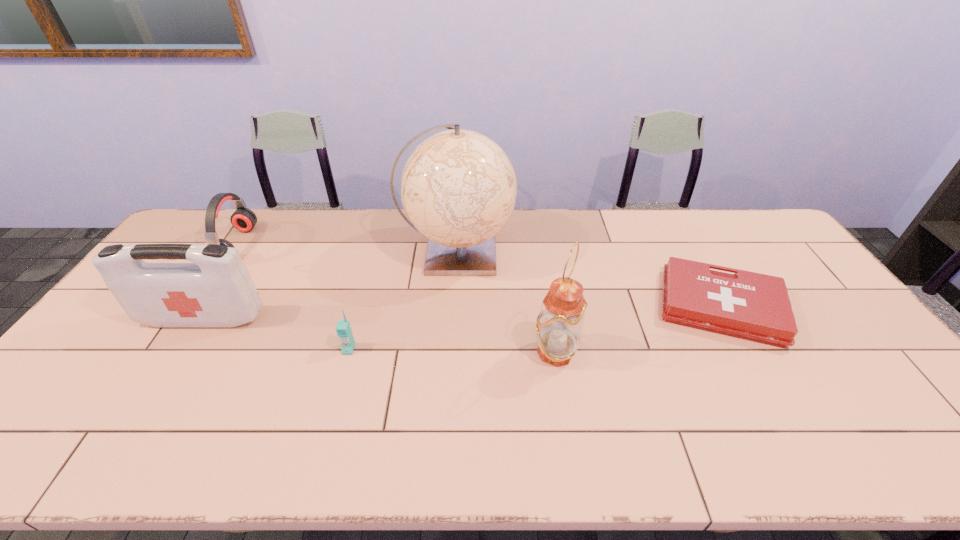
I want to click on the tallest object, so click(x=458, y=187).

Identify the location of the third object from right to left. The image size is (960, 540). (458, 187).

You are a GUI agent. You are given a task and a screenshot of the screen. Output one action in this format:
    pyautogui.click(x=<x>, y=<y>)
    Task: Click on the oil lamp
    
    Given the screenshot: What is the action you would take?
    pyautogui.click(x=559, y=325)

You are a GUI agent. You are given a task and a screenshot of the screen. Output one action in this format:
    pyautogui.click(x=<x>, y=<y>)
    Task: Click on the fifth object from left to right
    The image size is (960, 540).
    Given the screenshot: What is the action you would take?
    pyautogui.click(x=559, y=325)

Find the location of `the taller first-aid kit`. the taller first-aid kit is located at coordinates (217, 290).

Image resolution: width=960 pixels, height=540 pixels. Identify the location of the fourth shortest object. (217, 290).

Locate an element on the screen. Image resolution: width=960 pixels, height=540 pixels. the fourth tallest object is located at coordinates (243, 219).

Locate an element on the screen. This screenshot has width=960, height=540. cellular telephone is located at coordinates (343, 329).

Where is `the second shortest object`? the second shortest object is located at coordinates (343, 329).

In order to click on the shortest object in this screenshot , I will do `click(747, 305)`.